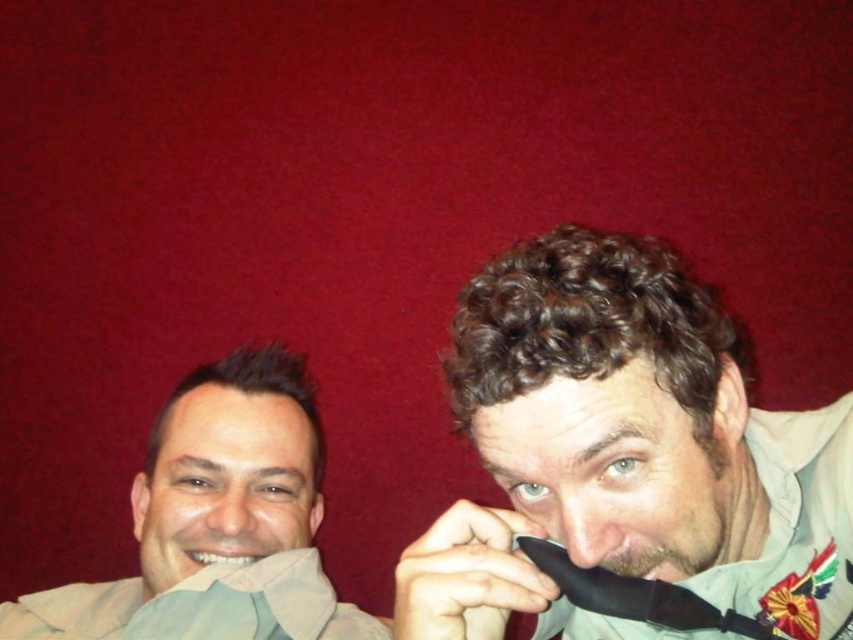
Question: Does dry matte nose at center appear over white glossy teeth at lower left?

Choices:
 (A) no
 (B) yes

Answer: (B)

Question: Which object is positioned closest to the matte beige shirt at left?

Choices:
 (A) dry matte nose at center
 (B) white glossy teeth at lower left
 (C) black matte tie at center
 (D) matte skin nose at center

Answer: (D)

Question: Which object is closer to the camera taking this photo?

Choices:
 (A) white glossy teeth at lower left
 (B) black satin tie at lower right
 (C) matte beige shirt at left
 (D) dry matte nose at center

Answer: (D)

Question: Can you confirm if black matte tie at center is positioned to the left of dry matte nose at center?

Choices:
 (A) yes
 (B) no

Answer: (B)

Question: Is black matte tie at center above matte skin nose at center?

Choices:
 (A) yes
 (B) no

Answer: (A)

Question: Among these points, which one is nearest to the camera?

Choices:
 (A) (563, 593)
 (B) (602, 381)

Answer: (B)